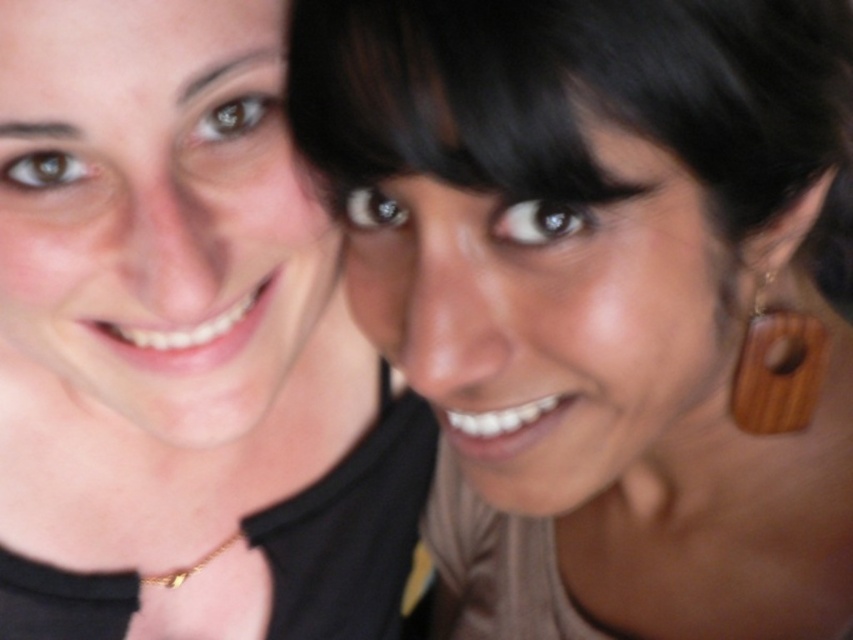
You are a photographer trying to focus on the matte black necklace at center and the gold chain at lower center. Which one is closer to the camera?

The matte black necklace at center is taller than the gold chain at lower center, so it is closer to the camera.

You are a photographer trying to adjust the lighting for a photo shoot. You notice the brown wooden earrings at upper right and the wooden pendant at right. Which object should you focus on to ensure proper lighting since it is taller?

The brown wooden earrings at upper right should be focused on for proper lighting since it is much taller than the wooden pendant at right.